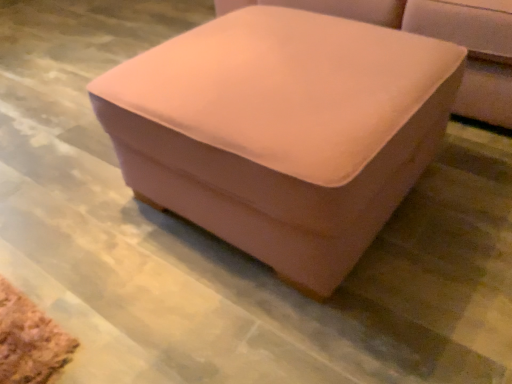
Describe the element at coordinates (282, 131) in the screenshot. I see `pink velvet ottoman at center` at that location.

This screenshot has height=384, width=512. I want to click on pink velvet ottoman at center, so click(282, 131).

The height and width of the screenshot is (384, 512). What do you see at coordinates (439, 38) in the screenshot?
I see `matte pink ottoman at center` at bounding box center [439, 38].

Locate an element on the screen. This screenshot has height=384, width=512. matte pink ottoman at center is located at coordinates (439, 38).

Find the location of a particular element. pink velvet ottoman at center is located at coordinates (282, 131).

In the scene shown: Can you confirm if pink velvet ottoman at center is positioned to the right of matte pink ottoman at center?

No, pink velvet ottoman at center is not to the right of matte pink ottoman at center.

Is the depth of pink velvet ottoman at center greater than that of matte pink ottoman at center?

No, pink velvet ottoman at center is closer to the camera.

From the picture: Which is closer to the camera, (364, 181) or (434, 13)?

The point (364, 181) is closer to the camera.

From the image's perspective, which one is positioned higher, pink velvet ottoman at center or matte pink ottoman at center?

From the image's view, matte pink ottoman at center is above.

From a real-world perspective, between pink velvet ottoman at center and matte pink ottoman at center, who is vertically higher?

matte pink ottoman at center.

Looking at this image, considering the sizes of pink velvet ottoman at center and matte pink ottoman at center in the image, is pink velvet ottoman at center wider or thinner than matte pink ottoman at center?

In the image, pink velvet ottoman at center appears to be more narrow than matte pink ottoman at center.

Is pink velvet ottoman at center shorter than matte pink ottoman at center?

Correct, pink velvet ottoman at center is not as tall as matte pink ottoman at center.

Can you confirm if pink velvet ottoman at center is smaller than matte pink ottoman at center?

Indeed, pink velvet ottoman at center has a smaller size compared to matte pink ottoman at center.

Would you say pink velvet ottoman at center is outside matte pink ottoman at center?

Yes, pink velvet ottoman at center is not within matte pink ottoman at center.

Is pink velvet ottoman at center far away from matte pink ottoman at center?

pink velvet ottoman at center is actually quite close to matte pink ottoman at center.

Is pink velvet ottoman at center looking in the opposite direction of matte pink ottoman at center?

Yes, pink velvet ottoman at center's orientation is away from matte pink ottoman at center.

This screenshot has width=512, height=384. Identify the location of studio couch behind the pink velvet ottoman at center. (439, 38).

Which object is positioned more to the right, matte pink ottoman at center or pink velvet ottoman at center?

matte pink ottoman at center is more to the right.

Between matte pink ottoman at center and pink velvet ottoman at center, which one is positioned behind?

matte pink ottoman at center.

Is point (502, 40) closer or farther from the camera than point (338, 131)?

Point (502, 40).

From the image's perspective, who appears lower, matte pink ottoman at center or pink velvet ottoman at center?

pink velvet ottoman at center.

From a real-world perspective, relative to pink velvet ottoman at center, is matte pink ottoman at center vertically above or below?

From a real-world perspective, matte pink ottoman at center is physically above pink velvet ottoman at center.

Looking at this image, which object is thinner, matte pink ottoman at center or pink velvet ottoman at center?

With smaller width is pink velvet ottoman at center.

Can you confirm if matte pink ottoman at center is shorter than pink velvet ottoman at center?

No.

Considering the relative sizes of matte pink ottoman at center and pink velvet ottoman at center in the image provided, is matte pink ottoman at center bigger than pink velvet ottoman at center?

Indeed, matte pink ottoman at center has a larger size compared to pink velvet ottoman at center.

Is pink velvet ottoman at center inside matte pink ottoman at center?

No, pink velvet ottoman at center is not a part of matte pink ottoman at center.

Is matte pink ottoman at center not near pink velvet ottoman at center?

No, there isn't a large distance between matte pink ottoman at center and pink velvet ottoman at center.

Does matte pink ottoman at center turn towards pink velvet ottoman at center?

Result: Yes, matte pink ottoman at center is oriented towards pink velvet ottoman at center.

What's the angular difference between matte pink ottoman at center and pink velvet ottoman at center's facing directions?

0.000702 degrees.

This screenshot has width=512, height=384. I want to click on studio couch positioned vertically above the pink velvet ottoman at center (from a real-world perspective), so click(439, 38).

Locate an element on the screen. The image size is (512, 384). furniture lying in front of the matte pink ottoman at center is located at coordinates pos(282,131).

The width and height of the screenshot is (512, 384). I want to click on furniture directly beneath the matte pink ottoman at center (from a real-world perspective), so click(x=282, y=131).